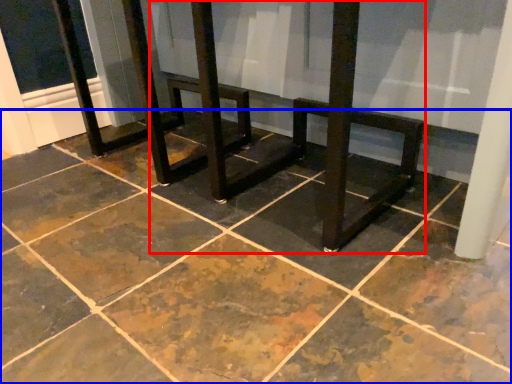
Question: Which object is further to the camera taking this photo, round table (highlighted by a red box) or concrete (highlighted by a blue box)?

Choices:
 (A) round table
 (B) concrete

Answer: (A)